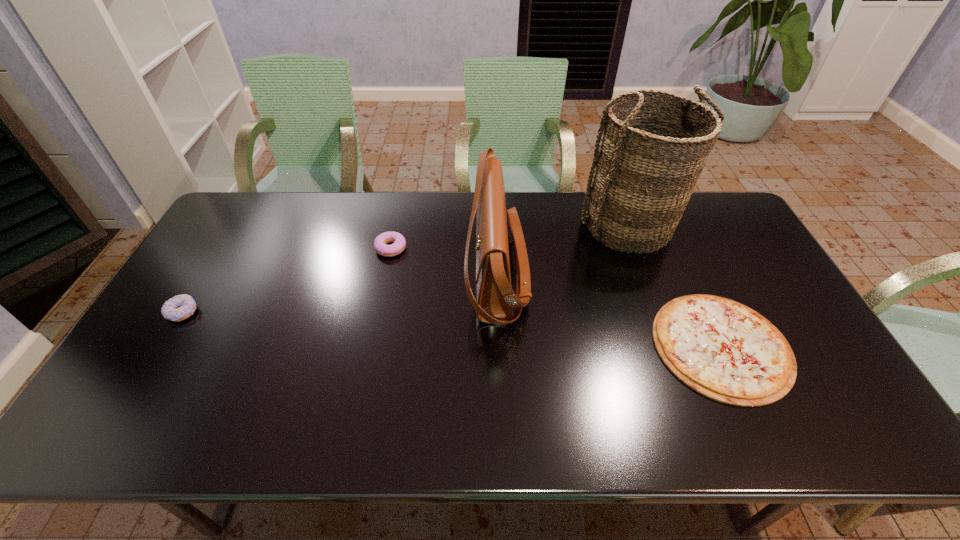
Where is `free space between the right doughnut and the nearer doughnut`? The width and height of the screenshot is (960, 540). free space between the right doughnut and the nearer doughnut is located at coordinates (286, 280).

This screenshot has width=960, height=540. I want to click on free area in between the third object from right to left and the pizza, so 609,310.

Find the location of a particular element. The width and height of the screenshot is (960, 540). empty space between the leftmost object and the pizza is located at coordinates (452, 329).

What are the coordinates of `free space between the fourth shortest object and the basket` in the screenshot? It's located at (563, 250).

This screenshot has width=960, height=540. I want to click on object that is the third closest to the nearer doughnut, so click(642, 177).

Select which object appears as the second closest to the shortest object. Please provide its 2D coordinates. Your answer should be formatted as a tuple, i.e. [(x, y)], where the tuple contains the x and y coordinates of a point satisfying the conditions above.

[(495, 301)]

At what (x,y) coordinates should I click in order to perform the action: click on free location that satisfies the following two spatial constraints: 1. on the back side of the pizza; 2. on the front flap of the satchel. Please return your answer as a coordinate pair (x, y). Looking at the image, I should click on (688, 274).

Identify the location of free space that satisfies the following two spatial constraints: 1. on the back side of the leftmost object; 2. on the right side of the tallest object. The width and height of the screenshot is (960, 540). (235, 226).